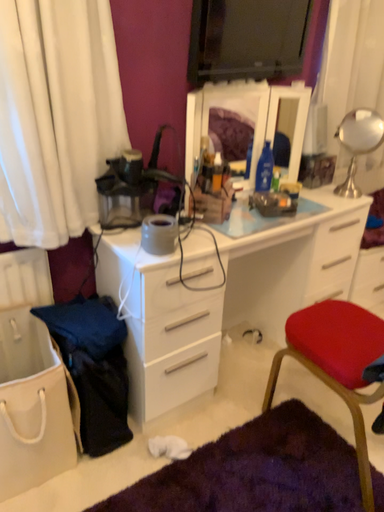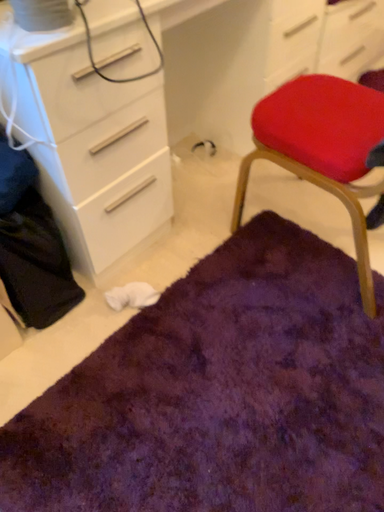
Question: How did the camera likely rotate when shooting the video?

Choices:
 (A) rotated left
 (B) rotated right

Answer: (B)